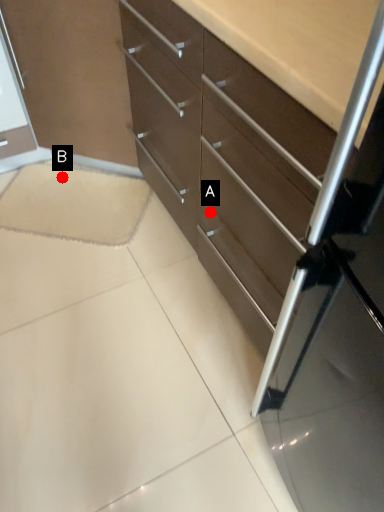
Question: Two points are circled on the image, labeled by A and B beside each circle. Which point is farther to the camera?

Choices:
 (A) A is further
 (B) B is further

Answer: (B)